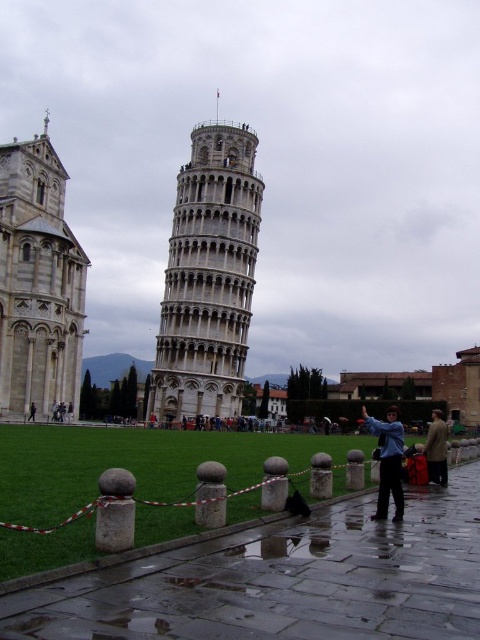
You are a tourist visiting the Leaning Tower of Pisa. You notice the blue fabric jacket at center and the white stone bell tower at left. From your vantage point, which object is closer to you?

The white stone bell tower at left is closer to you because the blue fabric jacket at center is behind it, indicating that the tower is in front.

Based on the photo, you are a tourist standing at the base of the white stone bell tower at left. You want to take a photo of the dark blue jeans at center without the tower in the background. Is there a way to do this by moving sideways along the paved pathway?

The white stone bell tower at left is positioned over the dark blue jeans at center, so if you move sideways along the paved pathway away from the tower, you can position yourself where the tower is no longer blocking the view of the dark blue jeans at center.

You are standing at the point marked by the coordinates (38, 284) in the image. What structure are you facing directly?

The point (38, 284) indicates the white stone bell tower at left, so you are facing directly the white stone bell tower at left.